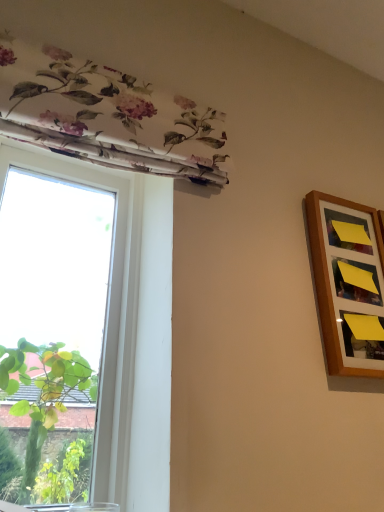
Question: Is wooden picture frame at right at the right side of white fabric window at upper left?

Choices:
 (A) yes
 (B) no

Answer: (A)

Question: Can you confirm if wooden picture frame at right is bigger than white fabric window at upper left?

Choices:
 (A) no
 (B) yes

Answer: (A)

Question: From the image's perspective, is wooden picture frame at right below white fabric window at upper left?

Choices:
 (A) yes
 (B) no

Answer: (B)

Question: Is wooden picture frame at right at the left side of white fabric window at upper left?

Choices:
 (A) no
 (B) yes

Answer: (A)

Question: Is wooden picture frame at right not near white fabric window at upper left?

Choices:
 (A) no
 (B) yes

Answer: (A)

Question: From a real-world perspective, is wooden picture frame at right located beneath white fabric window at upper left?

Choices:
 (A) yes
 (B) no

Answer: (B)

Question: Is white fabric window at upper left wider than wooden picture frame at right?

Choices:
 (A) yes
 (B) no

Answer: (A)

Question: Could you tell me if white fabric window at upper left is turned towards wooden picture frame at right?

Choices:
 (A) yes
 (B) no

Answer: (B)

Question: Is white fabric window at upper left located outside wooden picture frame at right?

Choices:
 (A) yes
 (B) no

Answer: (A)

Question: Does white fabric window at upper left have a greater height compared to wooden picture frame at right?

Choices:
 (A) no
 (B) yes

Answer: (B)

Question: Is white fabric window at upper left far away from wooden picture frame at right?

Choices:
 (A) yes
 (B) no

Answer: (B)

Question: Is white fabric window at upper left closer to the viewer compared to wooden picture frame at right?

Choices:
 (A) no
 (B) yes

Answer: (B)

Question: Does point (355, 315) appear closer or farther from the camera than point (127, 312)?

Choices:
 (A) closer
 (B) farther

Answer: (A)